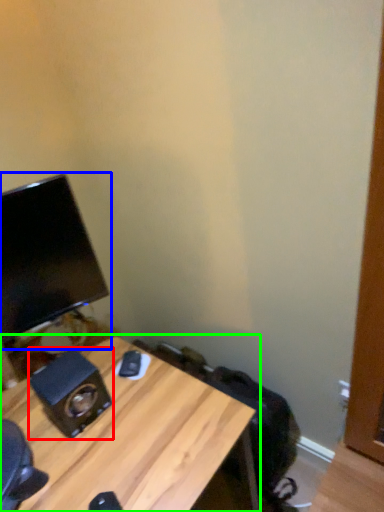
Question: Estimate the real-world distances between objects in this image. Which object is closer to speaker (highlighted by a red box), computer monitor (highlighted by a blue box) or desk (highlighted by a green box)?

Choices:
 (A) computer monitor
 (B) desk

Answer: (B)